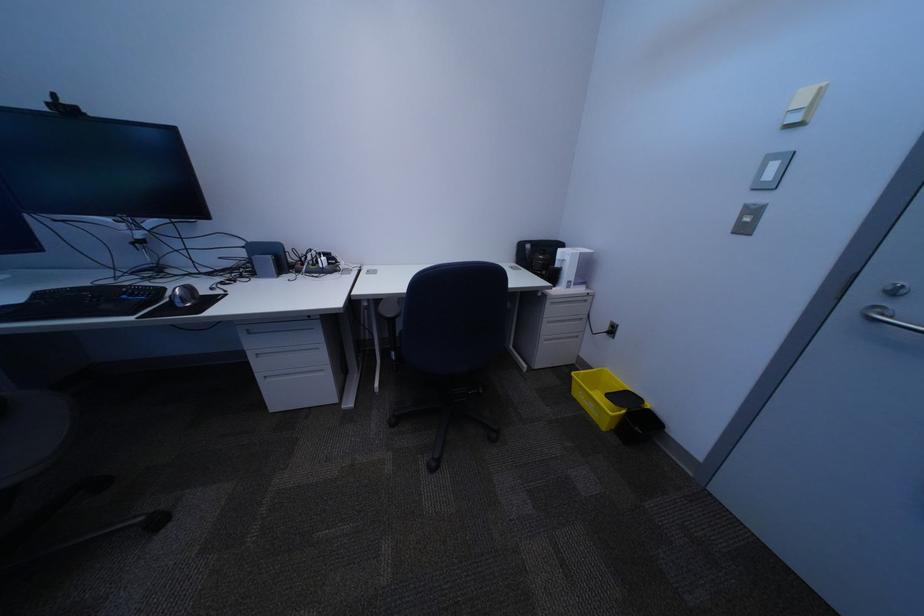
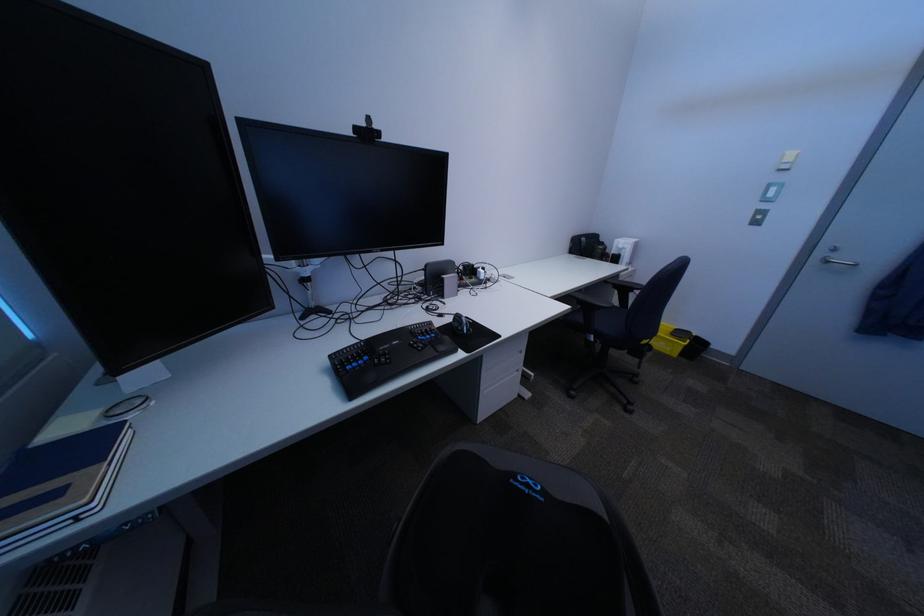
The point at (877, 299) is marked in the first image. Where is the corresponding point in the second image?

(834, 254)